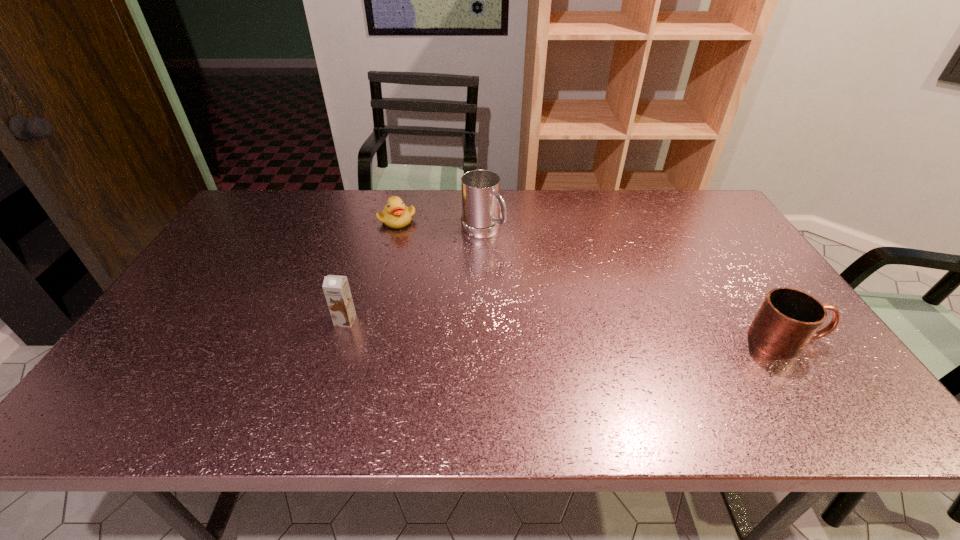
The width and height of the screenshot is (960, 540). Find the location of `free region located 0.200m on the front-facing side of the duckling`. free region located 0.200m on the front-facing side of the duckling is located at coordinates (449, 255).

This screenshot has height=540, width=960. In order to click on free space located 0.260m on the front-facing side of the duckling in this screenshot , I will do `click(463, 264)`.

Where is `vacant space located on the front-facing side of the duckling`? vacant space located on the front-facing side of the duckling is located at coordinates (444, 252).

Locate an element on the screen. mug located at the far edge is located at coordinates (480, 189).

Identify the location of duckling that is positioned at the far edge. This screenshot has height=540, width=960. (395, 214).

This screenshot has height=540, width=960. Identify the location of object present at the near edge. click(788, 319).

You are a GUI agent. You are given a task and a screenshot of the screen. Output one action in this format:
    pyautogui.click(x=<x>, y=<y>)
    Task: Click on the object that is at the right edge
    
    Given the screenshot: What is the action you would take?
    pyautogui.click(x=788, y=319)

At what (x,y) coordinates should I click in order to perform the action: click on object located at the near right corner. Please return your answer as a coordinate pair (x, y). Looking at the image, I should click on (788, 319).

Where is `vacant space at the far edge of the desktop`? The height and width of the screenshot is (540, 960). vacant space at the far edge of the desktop is located at coordinates (583, 217).

Identify the location of free space at the near edge of the desktop. (381, 381).